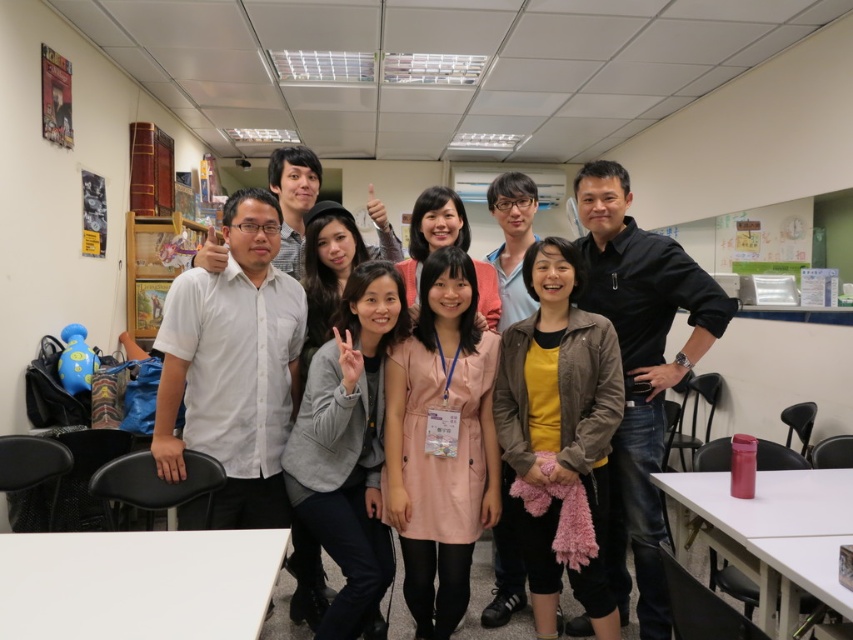
You are organizing a photo shoot and need to arrange the models according to their positions in the image. If the gray fabric jacket at center is positioned to the left of the pink fabric dress at center, which model should be placed first when moving from left to right?

The gray fabric jacket at center should be placed first when moving from left to right because it is positioned to the left of the pink fabric dress at center.